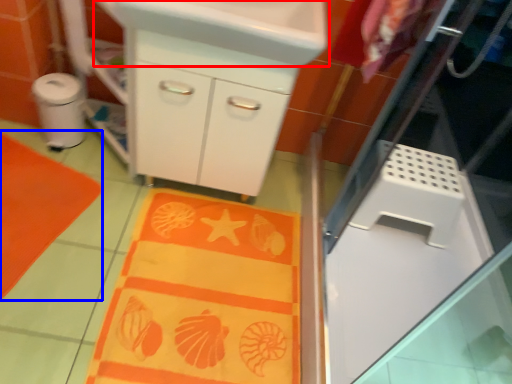
Question: Which object appears farthest to the camera in this image, sink (highlighted by a red box) or beach towel (highlighted by a blue box)?

Choices:
 (A) sink
 (B) beach towel

Answer: (B)